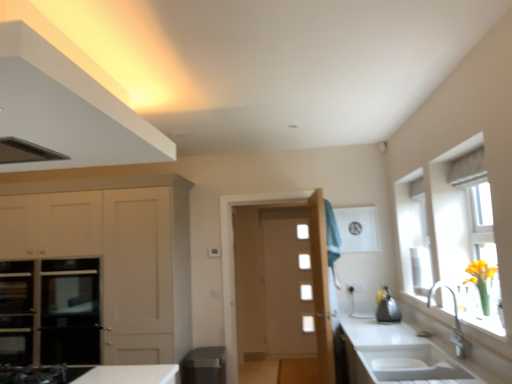
Question: Considering the relative sizes of translucent glass window at right and satin black kettle at right in the image provided, is translucent glass window at right thinner than satin black kettle at right?

Choices:
 (A) no
 (B) yes

Answer: (B)

Question: Could you tell me if translucent glass window at right is turned towards satin black kettle at right?

Choices:
 (A) no
 (B) yes

Answer: (A)

Question: From the image's perspective, is translucent glass window at right over satin black kettle at right?

Choices:
 (A) no
 (B) yes

Answer: (B)

Question: From a real-world perspective, is translucent glass window at right below satin black kettle at right?

Choices:
 (A) no
 (B) yes

Answer: (A)

Question: Is translucent glass window at right far away from satin black kettle at right?

Choices:
 (A) no
 (B) yes

Answer: (B)

Question: From a real-world perspective, is matte white cabinet at upper left, which is the 1th cabinetry from front to back, above or below white glass door at center?

Choices:
 (A) below
 (B) above

Answer: (B)

Question: In terms of height, does matte white cabinet at upper left, which is the 1th cabinetry from front to back, look taller or shorter compared to white glass door at center?

Choices:
 (A) short
 (B) tall

Answer: (A)

Question: Is point (37, 124) positioned closer to the camera than point (274, 336)?

Choices:
 (A) closer
 (B) farther

Answer: (A)

Question: Would you say matte white cabinet at upper left, which is counted as the 1th cabinetry, starting from the top, is inside or outside white glass door at center?

Choices:
 (A) outside
 (B) inside

Answer: (A)

Question: Is white matte cabinet at left, arranged as the first cabinetry when viewed from the back, to the left or to the right of white ceramic sink at lower right in the image?

Choices:
 (A) left
 (B) right

Answer: (A)

Question: Is white matte cabinet at left, the 1th cabinetry positioned from the bottom, taller or shorter than white ceramic sink at lower right?

Choices:
 (A) short
 (B) tall

Answer: (B)

Question: Is white matte cabinet at left, positioned as the 2th cabinetry in front-to-back order, spatially inside white ceramic sink at lower right, or outside of it?

Choices:
 (A) outside
 (B) inside

Answer: (A)

Question: Looking at their shapes, would you say white matte cabinet at left, positioned as the 2th cabinetry in front-to-back order, is wider or thinner than white ceramic sink at lower right?

Choices:
 (A) wide
 (B) thin

Answer: (A)

Question: From the image's perspective, is white ceramic sink at lower right positioned above or below white matte cabinet at left, arranged as the first cabinetry when viewed from the back?

Choices:
 (A) above
 (B) below

Answer: (B)

Question: In the image, is white ceramic sink at lower right positioned in front of or behind white matte cabinet at left, the 2th cabinetry positioned from the top?

Choices:
 (A) front
 (B) behind

Answer: (A)